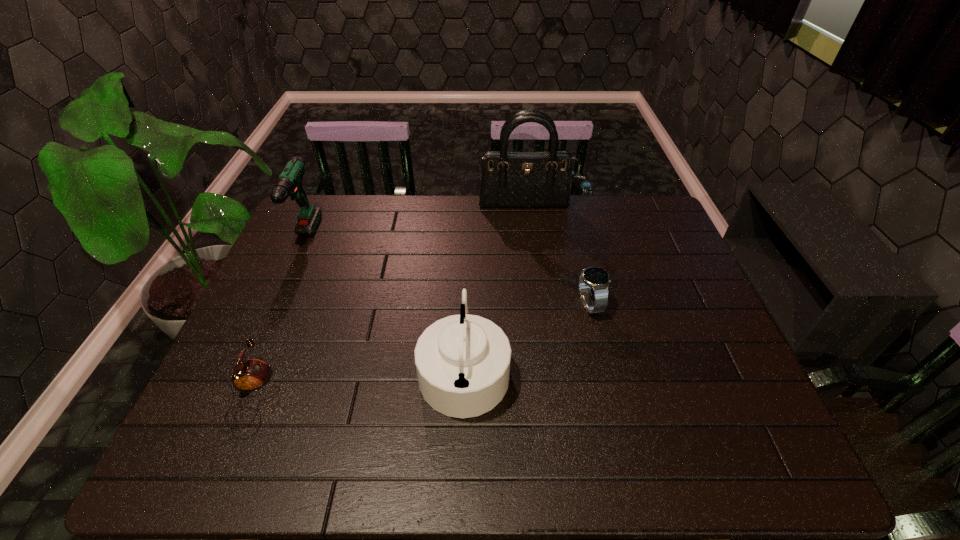
Locate an element on the screen. The height and width of the screenshot is (540, 960). vacant space located 0.230m on the spout of the third tallest object is located at coordinates (606, 368).

You are a GUI agent. You are given a task and a screenshot of the screen. Output one action in this format:
    pyautogui.click(x=<x>, y=<y>)
    Task: Click on the vacant space situated on the front of the third farthest object
    
    Given the screenshot: What is the action you would take?
    pyautogui.click(x=597, y=337)

Locate an element on the screen. Image resolution: width=960 pixels, height=540 pixels. free spot located 0.350m on the rotary dial of the telephone is located at coordinates pyautogui.click(x=433, y=396).

Find the location of `handbag present at the far edge`. handbag present at the far edge is located at coordinates (509, 179).

Find the location of a particular element. drill located in the far edge section of the desktop is located at coordinates (289, 183).

Where is `object positioned at the near edge`? The image size is (960, 540). object positioned at the near edge is located at coordinates (251, 375).

Locate an element on the screen. The width and height of the screenshot is (960, 540). drill that is at the left edge is located at coordinates (289, 183).

Locate an element on the screen. The height and width of the screenshot is (540, 960). telephone situated at the left edge is located at coordinates (251, 375).

Locate an element on the screen. object that is at the far left corner is located at coordinates (289, 183).

Locate an element on the screen. The image size is (960, 540). object at the near left corner is located at coordinates (251, 375).